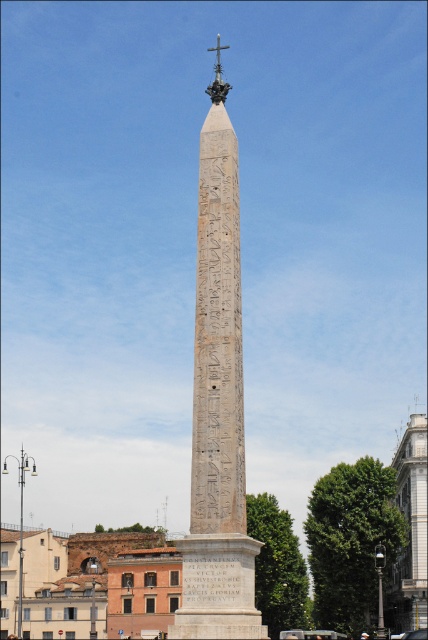
Question: Does carved stone obelisk at center lie behind white marble tower at right?

Choices:
 (A) yes
 (B) no

Answer: (B)

Question: Is carved stone obelisk at center thinner than white marble tower at right?

Choices:
 (A) no
 (B) yes

Answer: (A)

Question: Among these points, which one is farthest from the camera?

Choices:
 (A) (400, 625)
 (B) (202, 394)

Answer: (A)

Question: Which object appears farthest from the camera in this image?

Choices:
 (A) carved stone obelisk at center
 (B) white marble tower at right

Answer: (B)

Question: Observing the image, what is the correct spatial positioning of carved stone obelisk at center in reference to white marble tower at right?

Choices:
 (A) right
 (B) left

Answer: (B)